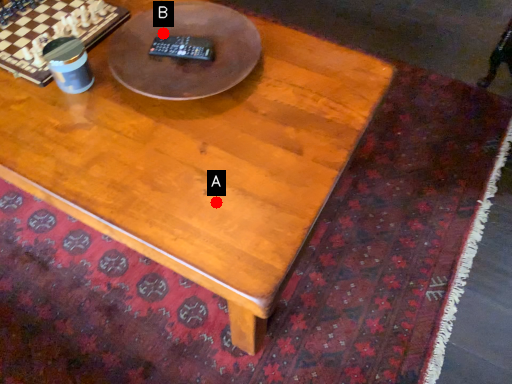
Question: Two points are circled on the image, labeled by A and B beside each circle. Which point appears farthest from the camera in this image?

Choices:
 (A) A is further
 (B) B is further

Answer: (B)